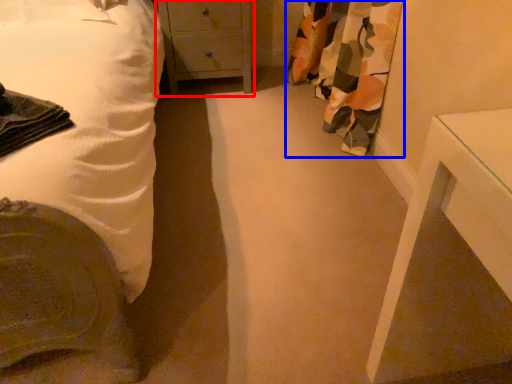
Question: Among these objects, which one is nearest to the camera, chest of drawers (highlighted by a red box) or curtain (highlighted by a blue box)?

Choices:
 (A) chest of drawers
 (B) curtain

Answer: (B)